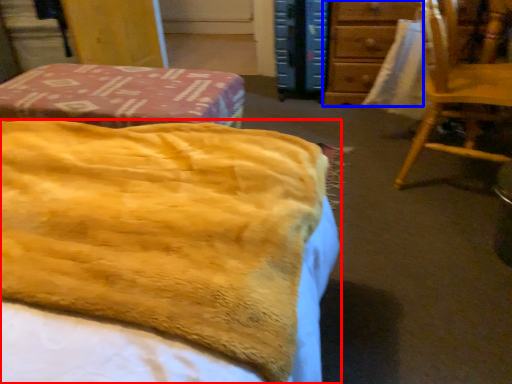
Question: Which object is closer to the camera taking this photo, bed (highlighted by a red box) or furniture (highlighted by a blue box)?

Choices:
 (A) bed
 (B) furniture

Answer: (A)